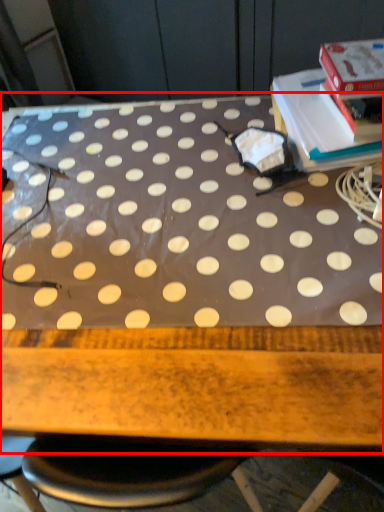
Question: Considering the relative positions of table (annotated by the red box) and paperback book in the image provided, where is table (annotated by the red box) located with respect to the staircase?

Choices:
 (A) left
 (B) right

Answer: (A)